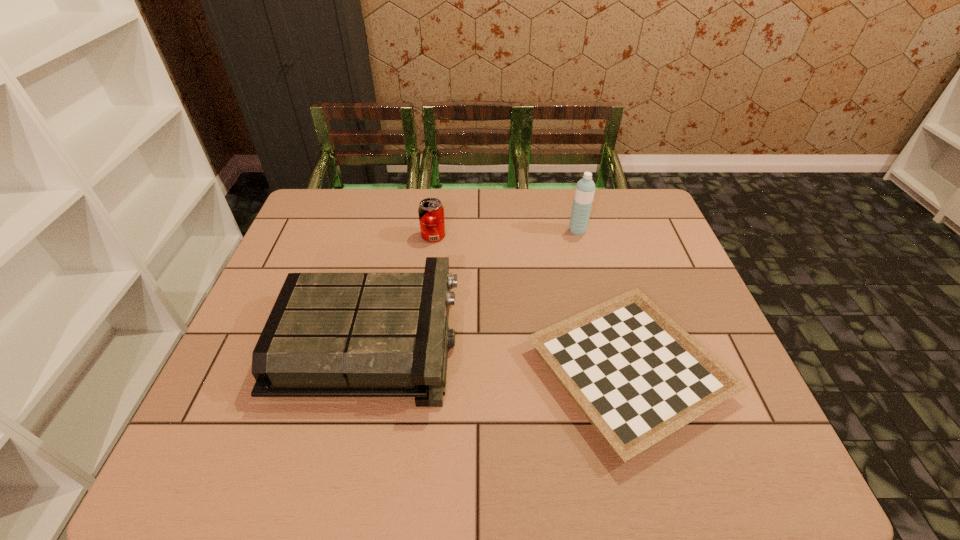
Where is `free area in between the water bottle and the soda can`? This screenshot has width=960, height=540. free area in between the water bottle and the soda can is located at coordinates (506, 233).

This screenshot has width=960, height=540. I want to click on empty location between the radio receiver and the shortest object, so click(x=499, y=356).

Identify the location of unoccupied area between the water bottle and the radio receiver. (474, 285).

Find the location of a particular element. empty space that is in between the shortest object and the water bottle is located at coordinates (603, 301).

Where is `vacant area that lies between the water bottle and the soda can`? The image size is (960, 540). vacant area that lies between the water bottle and the soda can is located at coordinates (506, 233).

This screenshot has width=960, height=540. Identify the location of free space between the shortest object and the radio receiver. coord(499,356).

Where is `vacant space that is in between the water bottle and the checkerboard`? Image resolution: width=960 pixels, height=540 pixels. vacant space that is in between the water bottle and the checkerboard is located at coordinates (603, 301).

The height and width of the screenshot is (540, 960). Find the location of `free area in between the shortest object and the radio receiver`. free area in between the shortest object and the radio receiver is located at coordinates (499, 356).

Where is `vacant space in between the radio receiver and the water bottle`? vacant space in between the radio receiver and the water bottle is located at coordinates (474, 285).

Identify the location of object that can be found as the second closest to the radio receiver. (431, 212).